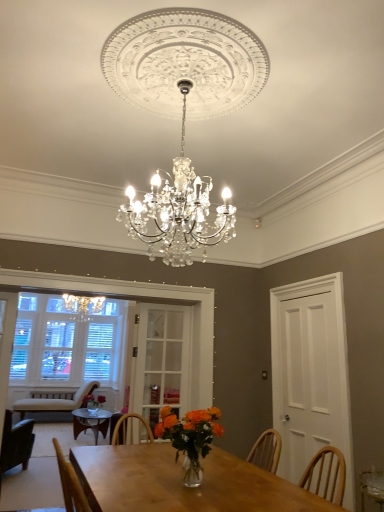
Question: From the image's perspective, is dark green fabric chair at left, which appears as the first chair when viewed from the front, above or below white wood door at right, positioned as the second glass door in left-to-right order?

Choices:
 (A) below
 (B) above

Answer: (A)

Question: Considering the positions of dark green fabric chair at left, which appears as the first chair when viewed from the front, and white wood door at right, positioned as the second glass door in left-to-right order, in the image, is dark green fabric chair at left, which appears as the first chair when viewed from the front, wider or thinner than white wood door at right, positioned as the second glass door in left-to-right order,?

Choices:
 (A) wide
 (B) thin

Answer: (A)

Question: Which object is positioned closest to the dark green fabric chair at left, the 2th chair from the back?

Choices:
 (A) beige fabric chair at left, acting as the 2th chair starting from the front
 (B) clear glass door at center, which appears as the 2th glass door when viewed from the right
 (C) white wood door at right, positioned as the second glass door in left-to-right order
 (D) translucent glass vase at center

Answer: (A)

Question: Which object is the closest to the beige fabric chair at left, which is counted as the second chair, starting from the top?

Choices:
 (A) translucent glass vase at center
 (B) dark green fabric chair at left, the 2th chair from the back
 (C) clear glass door at center, which appears as the 2th glass door when viewed from the right
 (D) white wood door at right, positioned as the second glass door in left-to-right order

Answer: (B)